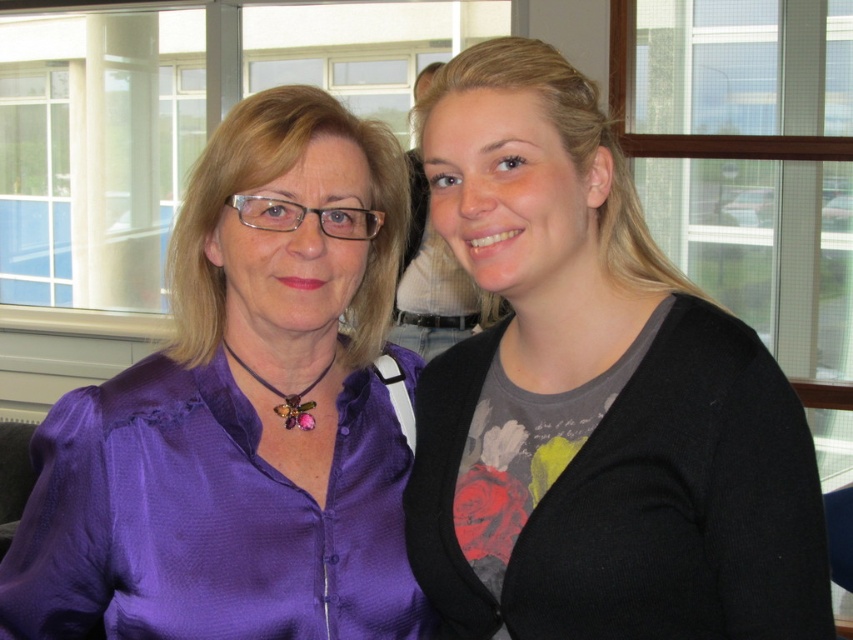
You are standing in the room where the two people are. You want to take a photo of the point at coordinate point [421,547]. The camera you have can only focus on objects within 35 inches. Will the point be in focus?

The point at coordinate point [421,547] is 37.32 inches away from the camera, which is beyond the camera focus limit of 35 inches. Therefore, the point will not be in focus.

You are organizing a clothing donation drive and need to determine which item takes up more space when folded. Which of the two items, the black matte sweater at right or the purple satin blouse at center, would require more storage space when folded?

The purple satin blouse at center requires more storage space when folded because it has a greater width than the black matte sweater at right.